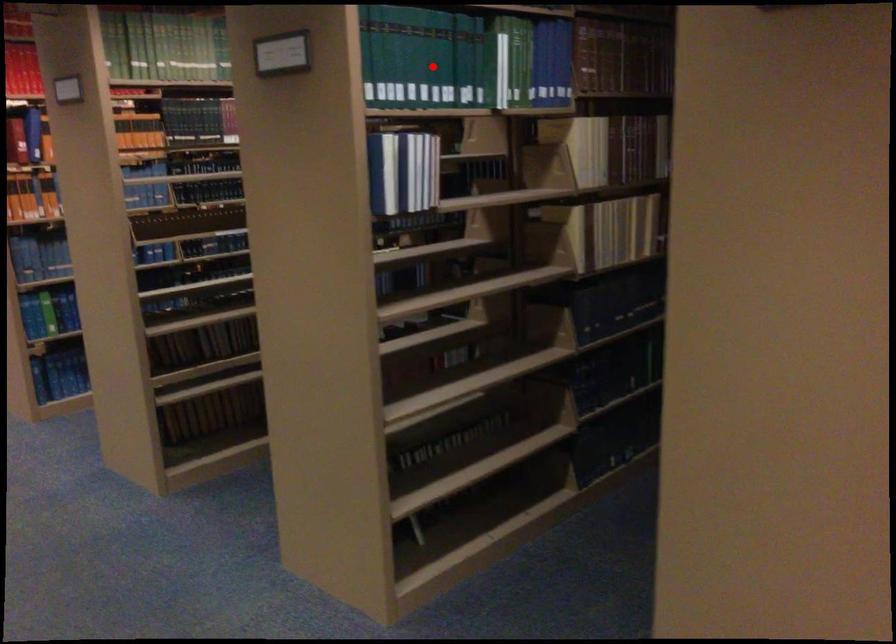
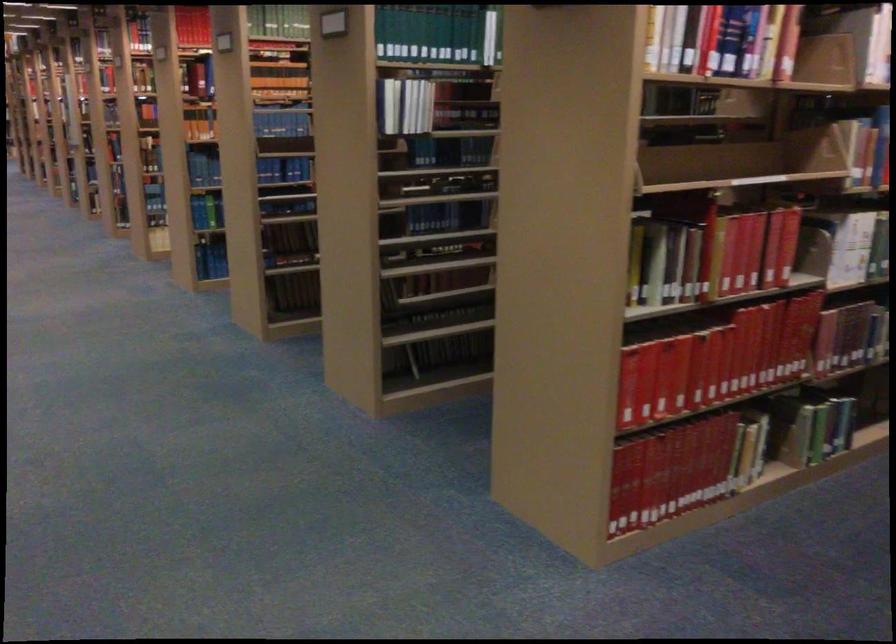
Locate, in the second image, the point that corresponds to the highlighted location in the first image.

(429, 33)